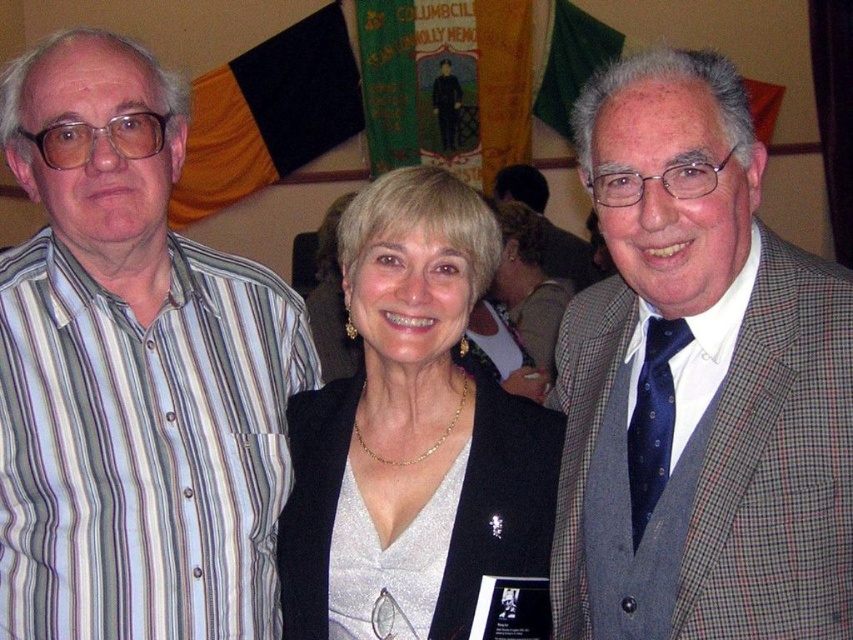
This screenshot has height=640, width=853. Find the location of `striped cotton shirt at left`. striped cotton shirt at left is located at coordinates (132, 372).

Between striped cotton shirt at left and silver metallic dress at center, which one appears on the right side from the viewer's perspective?

silver metallic dress at center

Who is more forward, (x=67, y=300) or (x=509, y=396)?

Positioned in front is point (x=67, y=300).

You are a GUI agent. You are given a task and a screenshot of the screen. Output one action in this format:
    pyautogui.click(x=<x>, y=<y>)
    Task: Click on the striped cotton shirt at left
    The width and height of the screenshot is (853, 640).
    Given the screenshot: What is the action you would take?
    pyautogui.click(x=132, y=372)

Which is below, striped cotton shirt at left or checkered wool suit at right?

checkered wool suit at right is below.

Is point (18, 323) in front of point (802, 372)?

No.

Describe the element at coordinates (132, 372) in the screenshot. The width and height of the screenshot is (853, 640). I see `striped cotton shirt at left` at that location.

Identify the location of striped cotton shirt at left. (132, 372).

Does striped cotton shirt at left lie in front of matte black jacket at center?

Yes.

Which is below, striped cotton shirt at left or matte black jacket at center?

striped cotton shirt at left is lower down.

This screenshot has height=640, width=853. In order to click on striped cotton shirt at left in this screenshot , I will do `click(132, 372)`.